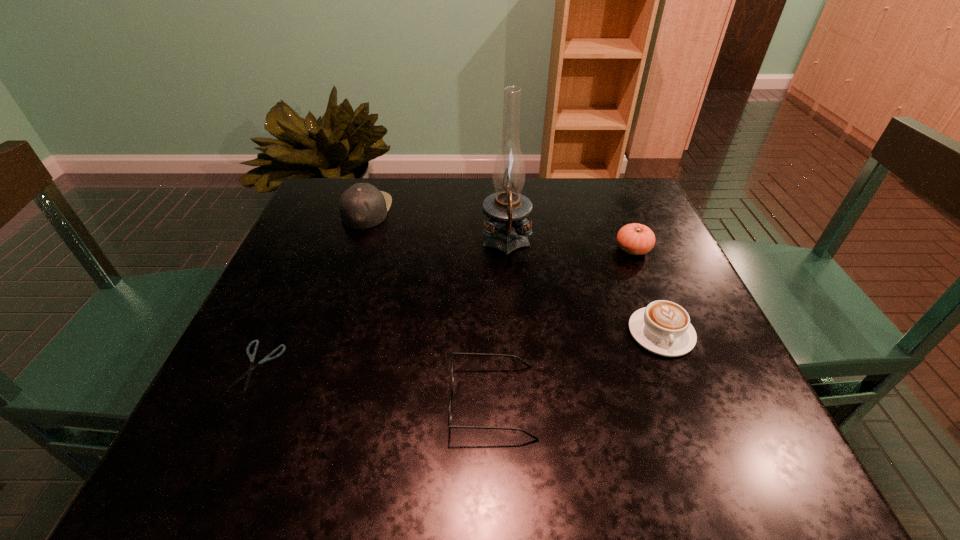
You are a GUI agent. You are given a task and a screenshot of the screen. Output one action in this format:
    pyautogui.click(x=<x>, y=<y>)
    Task: Click on the vacant region located 0.200m on the left of the third tallest object
    Image resolution: width=960 pixels, height=540 pixels.
    Given the screenshot: What is the action you would take?
    pyautogui.click(x=529, y=249)

This screenshot has height=540, width=960. Identify the location of free point located with the handle on the right side of the cappuccino. (691, 408).

Image resolution: width=960 pixels, height=540 pixels. What are the coordinates of `vacant area located 0.130m on the front-facing side of the spectacles` in the screenshot? It's located at (372, 401).

The image size is (960, 540). Find the location of `vacant space situated on the front-facing side of the spectacles`. vacant space situated on the front-facing side of the spectacles is located at coordinates (354, 401).

This screenshot has width=960, height=540. I want to click on blank space located 0.300m on the front-facing side of the spectacles, so click(270, 401).

This screenshot has height=540, width=960. In order to click on vacant space situated on the front of the shears in this screenshot , I will do `click(218, 457)`.

At what (x,y) coordinates should I click in order to perform the action: click on oil lamp that is positioned at the far edge. Please return your answer as a coordinate pair (x, y). Looking at the image, I should click on (506, 209).

Where is `cap positioned at the far edge`? cap positioned at the far edge is located at coordinates (362, 206).

The height and width of the screenshot is (540, 960). What are the coordinates of `object at the near edge` in the screenshot? It's located at (453, 353).

This screenshot has width=960, height=540. In order to click on cap that is at the left edge in this screenshot , I will do `click(362, 206)`.